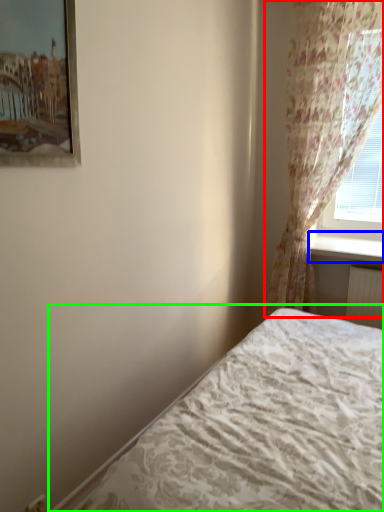
Question: Considering the real-world distances, which object is farthest from curtain (highlighted by a red box)? window sill (highlighted by a blue box) or bed (highlighted by a green box)?

Choices:
 (A) window sill
 (B) bed

Answer: (B)